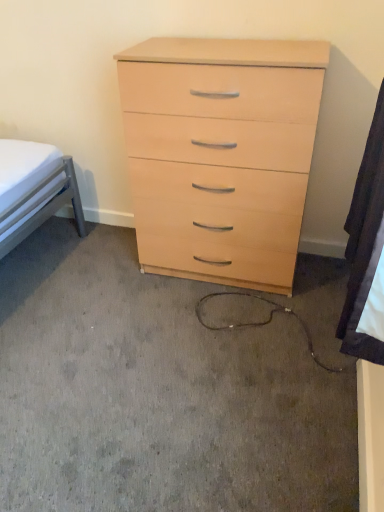
Locate an element on the screen. vacant space positioned to the left of light wood/finish chest of drawers at center is located at coordinates (96, 271).